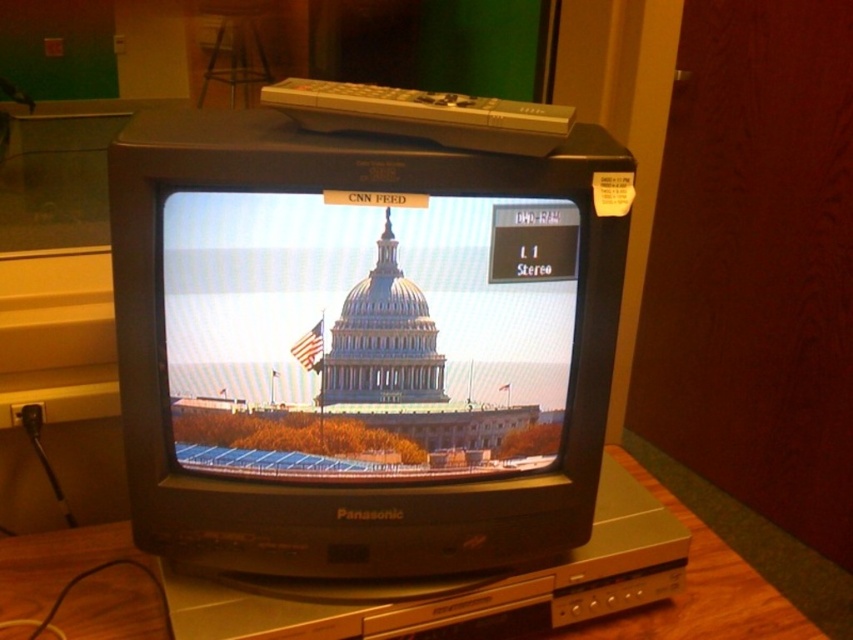
Question: Can you confirm if matte glass dome at center is positioned below wooden table at center?

Choices:
 (A) no
 (B) yes

Answer: (A)

Question: Is matte glass dome at center thinner than wooden table at center?

Choices:
 (A) yes
 (B) no

Answer: (B)

Question: Is matte glass dome at center above wooden table at center?

Choices:
 (A) yes
 (B) no

Answer: (A)

Question: Which point is closer to the camera?

Choices:
 (A) (485, 396)
 (B) (704, 525)

Answer: (A)

Question: Which of the following is the closest to the observer?

Choices:
 (A) wooden table at center
 (B) matte glass dome at center

Answer: (B)